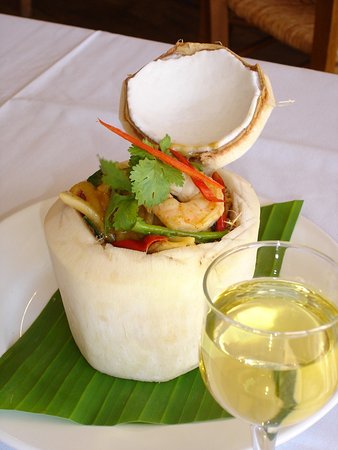
Locate an element on the screen. The image size is (338, 450). glass is located at coordinates (256, 387).